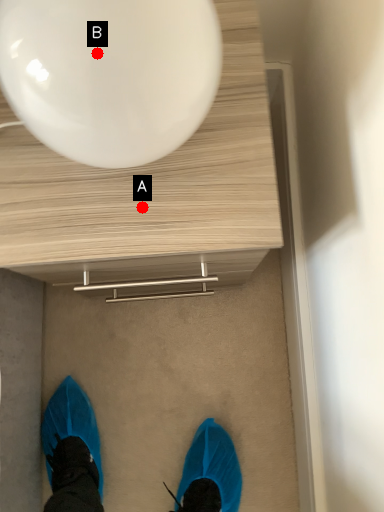
Question: Two points are circled on the image, labeled by A and B beside each circle. Which point appears closest to the camera in this image?

Choices:
 (A) A is closer
 (B) B is closer

Answer: (B)